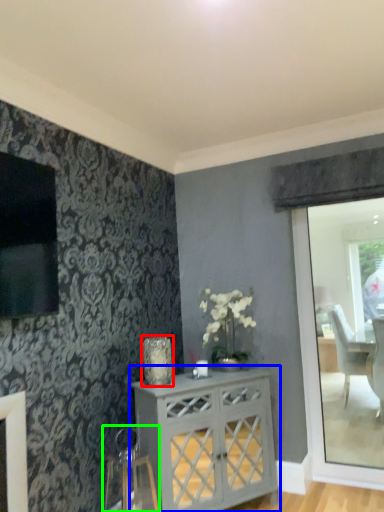
Question: Which is nearer to the vase (highlighted by a red box)? desk (highlighted by a blue box) or swivel chair (highlighted by a green box).

Choices:
 (A) desk
 (B) swivel chair

Answer: (A)